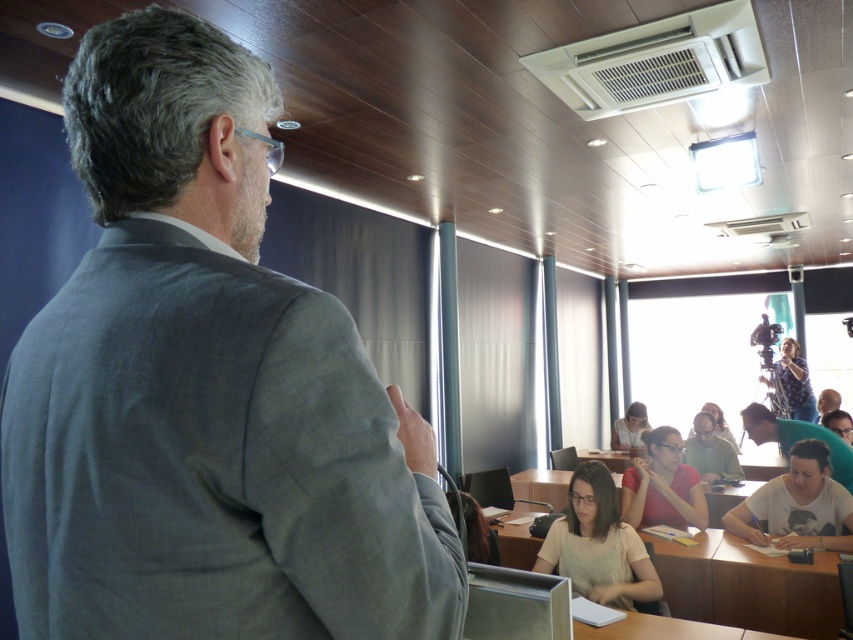
You are a student sitting in the classroom and want to know what is located at the specific coordinate point mentioned. What object is positioned at point [798,506] in the classroom scene?

The white matte shirt at lower right is located at point [798,506].

You are standing in the classroom and want to locate the white matte shirt at lower right. What are the coordinates where you should look?

The white matte shirt at lower right is located at coordinates point (798, 506).

You are a student sitting at the back of the classroom. You see the point marked at coordinates (x=212, y=460). What is the object located at that point?

The point at coordinates (x=212, y=460) marks the gray linen suit at upper left.